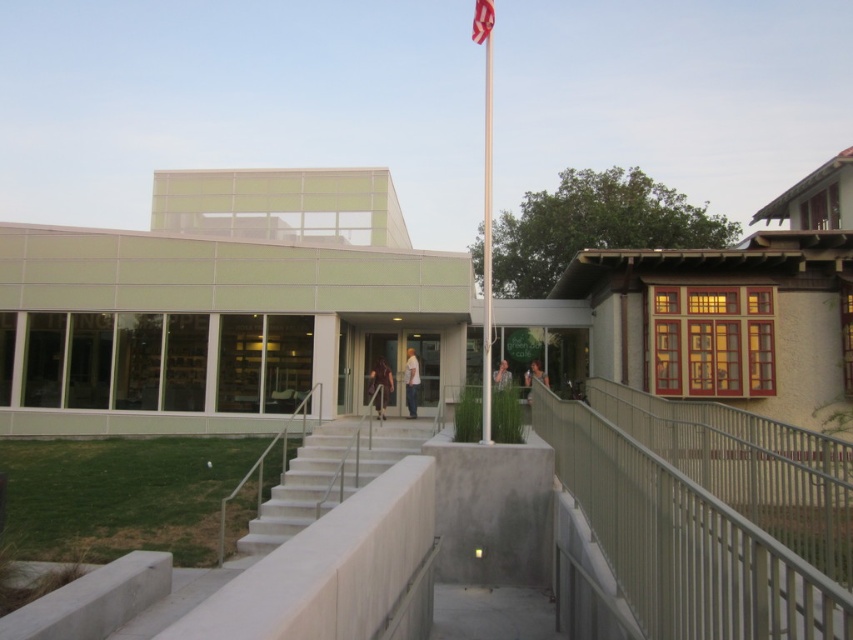
Question: Considering the real-world distances, which object is closest to the metallic flag pole at center?

Choices:
 (A) metallic gray railing at lower right
 (B) polished metal flag pole at center
 (C) white concrete stairs at center

Answer: (B)

Question: Which object is the farthest from the white cotton shirt at center?

Choices:
 (A) white concrete stairs at center
 (B) dark brown leather jacket at center
 (C) metallic flag pole at center
 (D) polished metal flag pole at center

Answer: (C)

Question: Among these objects, which one is nearest to the camera?

Choices:
 (A) metallic gray railing at lower right
 (B) white cotton shirt at center
 (C) matte black jacket at center
 (D) dark brown leather jacket at center

Answer: (A)

Question: In this image, where is dark brown leather jacket at center located relative to matte black jacket at center?

Choices:
 (A) left
 (B) right

Answer: (A)

Question: Does white concrete stairs at center appear over matte black jacket at center?

Choices:
 (A) yes
 (B) no

Answer: (B)

Question: Observing the image, what is the correct spatial positioning of metallic flag pole at center in reference to polished metal flag pole at center?

Choices:
 (A) below
 (B) above

Answer: (B)